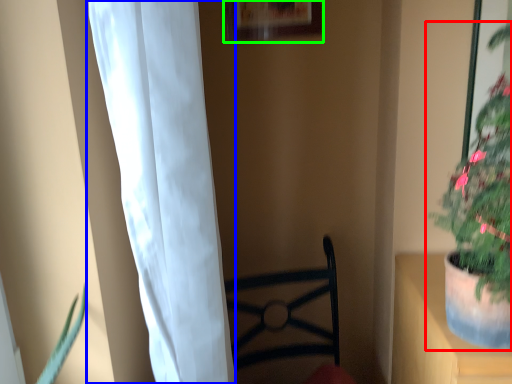
Question: Considering the real-world distances, which object is farthest from houseplant (highlighted by a red box)? curtain (highlighted by a blue box) or picture frame (highlighted by a green box)?

Choices:
 (A) curtain
 (B) picture frame

Answer: (B)